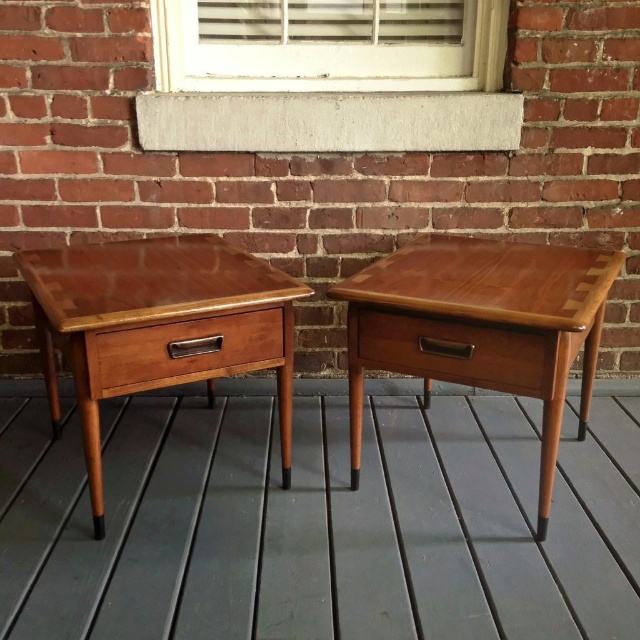
Can you confirm if matte wood drawer at center is wider than wooden drawer at left?

Yes, matte wood drawer at center is wider than wooden drawer at left.

Is point (541, 339) positioned after point (104, 340)?

Yes, it is.

The height and width of the screenshot is (640, 640). Identify the location of matte wood drawer at center. (454, 349).

Is point (435, 294) farther from camera compared to point (532, 371)?

That is True.

Between point (586, 278) and point (445, 333), which one is positioned behind?

The point (586, 278) is behind.

Describe the element at coordinates (481, 326) in the screenshot. This screenshot has width=640, height=640. I see `mahogany wood side table at center` at that location.

The image size is (640, 640). Find the location of `mahogany wood side table at center`. mahogany wood side table at center is located at coordinates (481, 326).

Can you confirm if mahogany wood table at left is positioned below wooden drawer at left?

No, mahogany wood table at left is not below wooden drawer at left.

Who is lower down, mahogany wood table at left or wooden drawer at left?

wooden drawer at left is below.

Is point (112, 378) positioned in front of point (195, 330)?

Yes, point (112, 378) is in front of point (195, 330).

The image size is (640, 640). In order to click on mahogany wood table at left in this screenshot , I will do `click(157, 324)`.